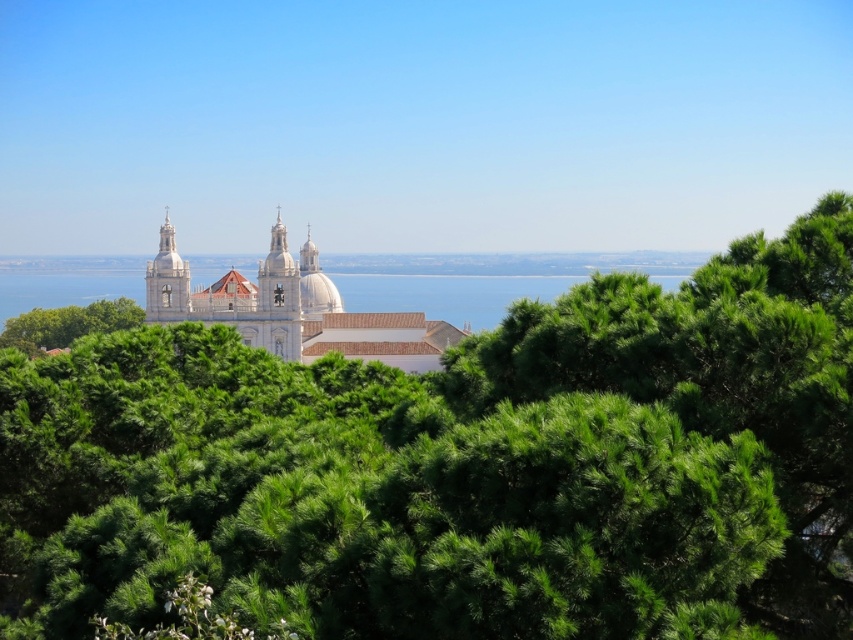
You are an architect visiting the historic site and want to take a photo of both the green leafy tree at center and the white smooth church at center. Since you have a camera with a fixed focal length, you need to know which one is wider to ensure both fit in the frame. Can you determine which object is wider?

The green leafy tree at center is wider than the white smooth church at center, so you should position your camera to accommodate the tree first to ensure both fit in the frame.